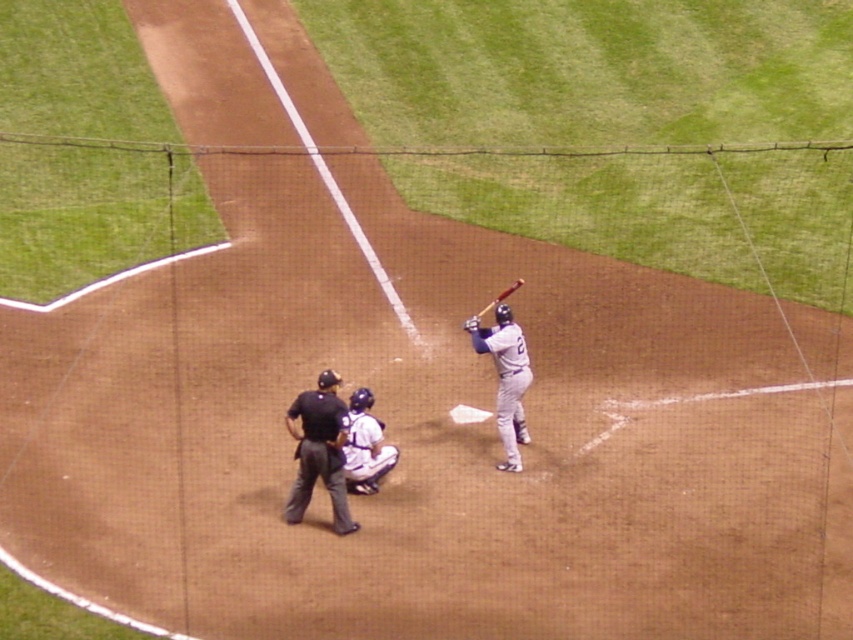
Which is above, wooden baseball bat at center or dark brown leather glove at center?

wooden baseball bat at center is above.

Does wooden baseball bat at center have a lesser width compared to dark brown leather glove at center?

No, wooden baseball bat at center is not thinner than dark brown leather glove at center.

Where is `wooden baseball bat at center`? The image size is (853, 640). wooden baseball bat at center is located at coordinates (502, 296).

How much distance is there between white matte uniform at center and dark brown leather glove at center?

A distance of 5.35 feet exists between white matte uniform at center and dark brown leather glove at center.

Is white matte uniform at center shorter than dark brown leather glove at center?

No, white matte uniform at center is not shorter than dark brown leather glove at center.

Who is more distant from viewer, (x=370, y=465) or (x=476, y=324)?

The point (x=476, y=324) is more distant.

I want to click on white matte uniform at center, so click(364, 445).

Which is in front, point (335, 400) or point (503, 349)?

Point (335, 400)

Which is more to the right, black fabric umpire at center or gray matte uniform at center?

gray matte uniform at center

Who is more forward, (294, 518) or (479, 333)?

Point (294, 518) is in front.

Where is `black fabric umpire at center`? black fabric umpire at center is located at coordinates (318, 451).